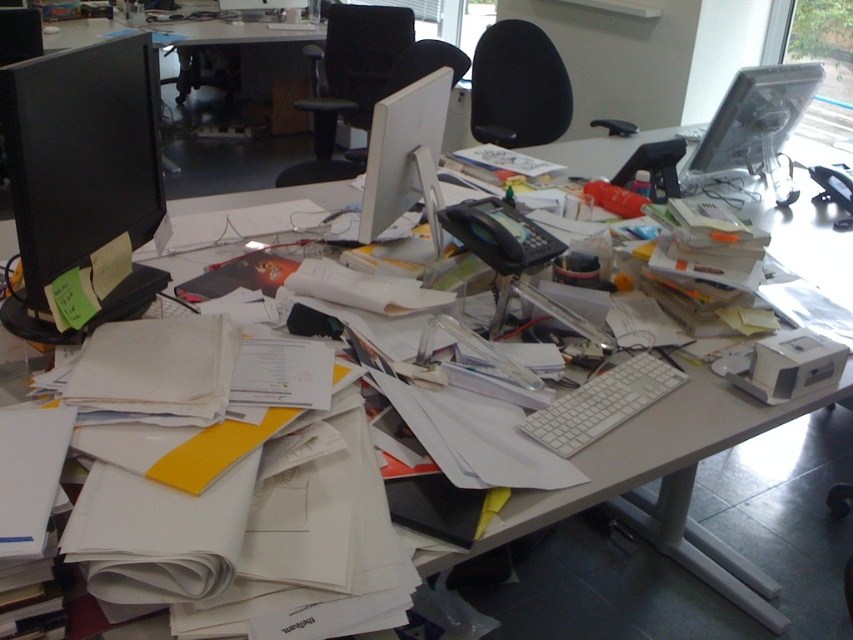
Is white glossy computer monitor at center below white plastic keyboard at center?

No.

This screenshot has height=640, width=853. I want to click on white glossy computer monitor at center, so click(405, 156).

Describe the element at coordinates (405, 156) in the screenshot. I see `white glossy computer monitor at center` at that location.

You are a GUI agent. You are given a task and a screenshot of the screen. Output one action in this format:
    pyautogui.click(x=<x>, y=<y>)
    Task: Click on the white glossy computer monitor at center
    
    Given the screenshot: What is the action you would take?
    pyautogui.click(x=405, y=156)

Does matte black monitor at left appear under matte black monitor at upper right?

Correct, matte black monitor at left is located below matte black monitor at upper right.

Is point (39, 262) more distant than point (814, 64)?

No, (39, 262) is in front of (814, 64).

Does point (61, 189) come behind point (722, 161)?

No, (61, 189) is in front of (722, 161).

What are the coordinates of `matte black monitor at left` in the screenshot? It's located at (82, 184).

In the scene shown: Which of these two, black fabric swivel chair at center or white glossy computer monitor at center, stands shorter?

With less height is white glossy computer monitor at center.

Describe the element at coordinates (350, 83) in the screenshot. Image resolution: width=853 pixels, height=640 pixels. I see `black fabric swivel chair at center` at that location.

The width and height of the screenshot is (853, 640). In order to click on black fabric swivel chair at center in this screenshot , I will do `click(350, 83)`.

I want to click on black fabric swivel chair at center, so click(x=350, y=83).